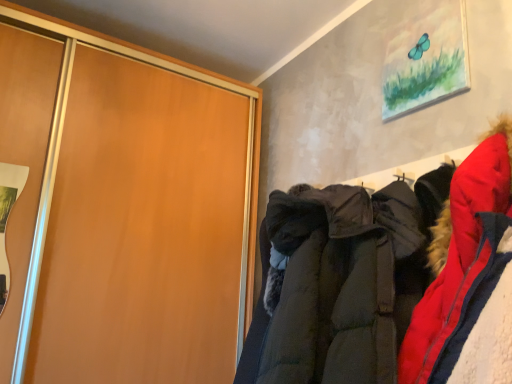
The image size is (512, 384). Describe the element at coordinates (120, 209) in the screenshot. I see `matte wood cupboard at left` at that location.

Locate an element on the screen. This screenshot has height=384, width=512. matte wood cupboard at left is located at coordinates (120, 209).

Describe the element at coordinates (335, 285) in the screenshot. I see `dark green quilted jacket at center` at that location.

Where is `dark green quilted jacket at center`? This screenshot has width=512, height=384. dark green quilted jacket at center is located at coordinates (335, 285).

Where is `matte wood cupboard at left`? This screenshot has width=512, height=384. matte wood cupboard at left is located at coordinates (120, 209).

Considering the relative positions of dark green quilted jacket at center and matte wood cupboard at left in the image provided, is dark green quilted jacket at center to the left of matte wood cupboard at left from the viewer's perspective?

In fact, dark green quilted jacket at center is to the right of matte wood cupboard at left.

Between dark green quilted jacket at center and matte wood cupboard at left, which one is positioned in front?

dark green quilted jacket at center is closer to the camera.

From the picture: Which is farther, (286, 280) or (10, 304)?

Positioned behind is point (10, 304).

From the image's perspective, does dark green quilted jacket at center appear lower than matte wood cupboard at left?

Yes, from the image's perspective, dark green quilted jacket at center is below matte wood cupboard at left.

From a real-world perspective, who is located lower, dark green quilted jacket at center or matte wood cupboard at left?

From a 3D spatial view, dark green quilted jacket at center is below.

Which object is wider, dark green quilted jacket at center or matte wood cupboard at left?

dark green quilted jacket at center is wider.

Considering the sizes of objects dark green quilted jacket at center and matte wood cupboard at left in the image provided, who is taller, dark green quilted jacket at center or matte wood cupboard at left?

With more height is matte wood cupboard at left.

Is dark green quilted jacket at center smaller than matte wood cupboard at left?

Yes, dark green quilted jacket at center is smaller than matte wood cupboard at left.

Which is correct: dark green quilted jacket at center is inside matte wood cupboard at left, or outside of it?

dark green quilted jacket at center is located beyond the bounds of matte wood cupboard at left.

Looking at this image, would you consider dark green quilted jacket at center to be distant from matte wood cupboard at left?

dark green quilted jacket at center is actually quite close to matte wood cupboard at left.

Is dark green quilted jacket at center oriented away from matte wood cupboard at left?

No.

How different are the orientations of dark green quilted jacket at center and matte wood cupboard at left in degrees?

91.9 degrees separate the facing orientations of dark green quilted jacket at center and matte wood cupboard at left.

At what (x,y) coordinates should I click in order to perform the action: click on jacket that appears below the matte wood cupboard at left (from the image's perspective). Please return your answer as a coordinate pair (x, y). Looking at the image, I should click on (335, 285).

Can you confirm if matte wood cupboard at left is positioned to the right of dark green quilted jacket at center?

No.

Considering the positions of objects matte wood cupboard at left and dark green quilted jacket at center in the image provided, who is in front, matte wood cupboard at left or dark green quilted jacket at center?

dark green quilted jacket at center is in front.

Which is behind, point (166, 265) or point (291, 265)?

Positioned behind is point (166, 265).

In the scene shown: From the image's perspective, which is below, matte wood cupboard at left or dark green quilted jacket at center?

dark green quilted jacket at center appears lower in the image.

From a real-world perspective, does matte wood cupboard at left sit lower than dark green quilted jacket at center?

No, from a real-world perspective, matte wood cupboard at left is not beneath dark green quilted jacket at center.

Between matte wood cupboard at left and dark green quilted jacket at center, which one has smaller width?

Thinner between the two is matte wood cupboard at left.

From their relative heights in the image, would you say matte wood cupboard at left is taller or shorter than dark green quilted jacket at center?

Clearly, matte wood cupboard at left is taller compared to dark green quilted jacket at center.

Which of these two, matte wood cupboard at left or dark green quilted jacket at center, is smaller?

dark green quilted jacket at center is smaller.

Choose the correct answer: Is matte wood cupboard at left inside dark green quilted jacket at center or outside it?

The correct answer is: outside.

Is matte wood cupboard at left in contact with dark green quilted jacket at center?

No, matte wood cupboard at left is not in contact with dark green quilted jacket at center.

Is matte wood cupboard at left oriented away from dark green quilted jacket at center?

No, matte wood cupboard at left is not facing away from dark green quilted jacket at center.

How many degrees apart are the facing directions of matte wood cupboard at left and dark green quilted jacket at center?

91.9 degrees separate the facing orientations of matte wood cupboard at left and dark green quilted jacket at center.

The width and height of the screenshot is (512, 384). Find the location of `cupboard that appears on the left of dark green quilted jacket at center`. cupboard that appears on the left of dark green quilted jacket at center is located at coordinates (120, 209).

Locate an element on the screen. Image resolution: width=512 pixels, height=384 pixels. jacket that is in front of the matte wood cupboard at left is located at coordinates (335, 285).

In the image, there is a matte wood cupboard at left. What are the coordinates of `jacket below it (from a real-world perspective)` in the screenshot? It's located at (335, 285).